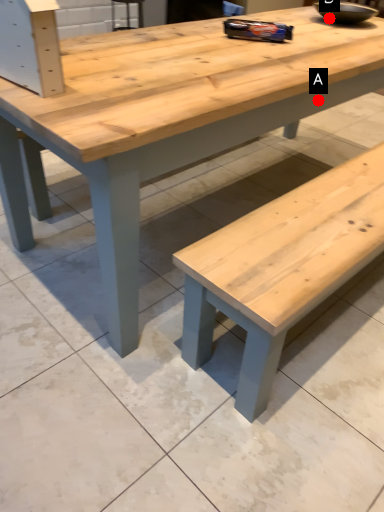
Question: Two points are circled on the image, labeled by A and B beside each circle. Which point is farther to the camera?

Choices:
 (A) A is further
 (B) B is further

Answer: (B)